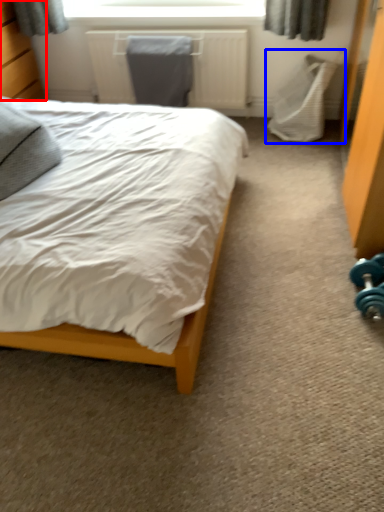
Question: Among these objects, which one is farthest to the camera, dresser (highlighted by a red box) or swivel chair (highlighted by a blue box)?

Choices:
 (A) dresser
 (B) swivel chair

Answer: (B)